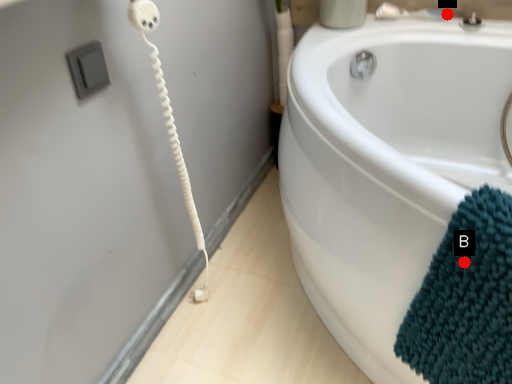
Question: Two points are circled on the image, labeled by A and B beside each circle. Which point appears closest to the camera in this image?

Choices:
 (A) A is closer
 (B) B is closer

Answer: (B)